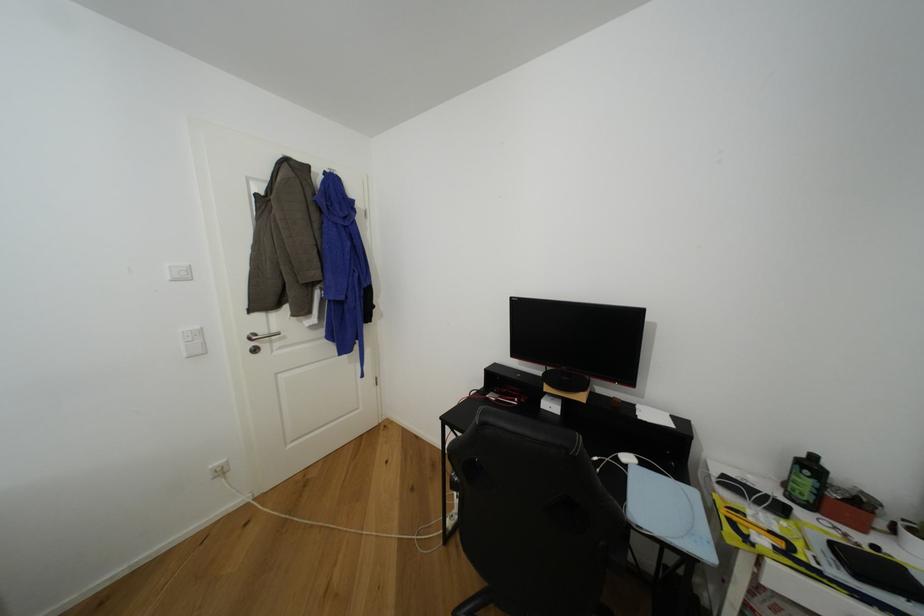
Which object does [806,482] point to?

This point indicates the green bottle.